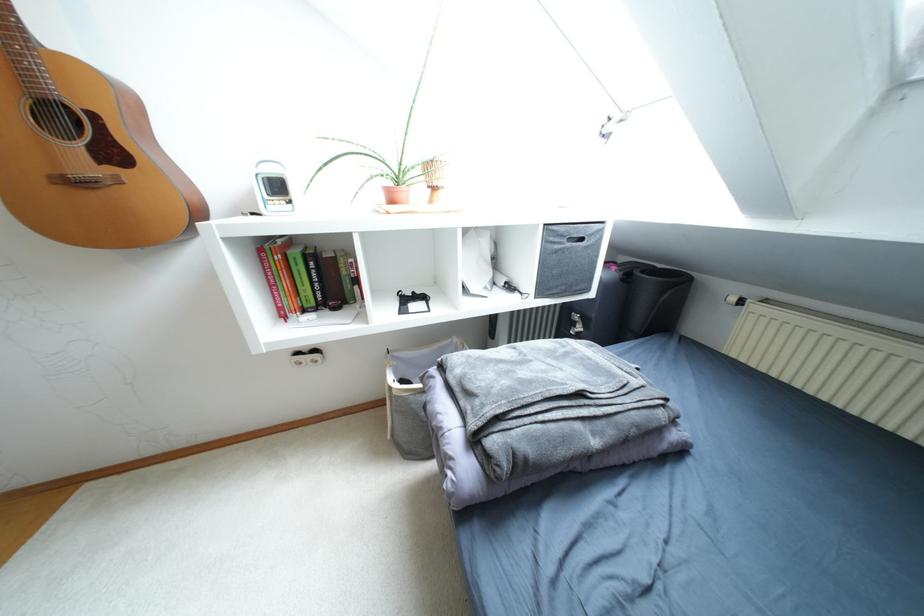
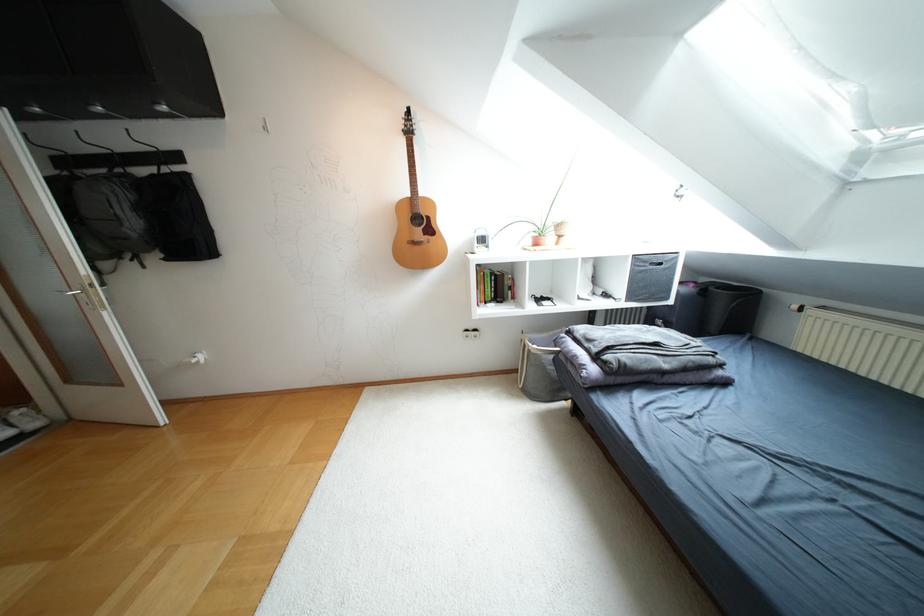
The point at (334, 257) is marked in the first image. Where is the corresponding point in the second image?

(502, 275)